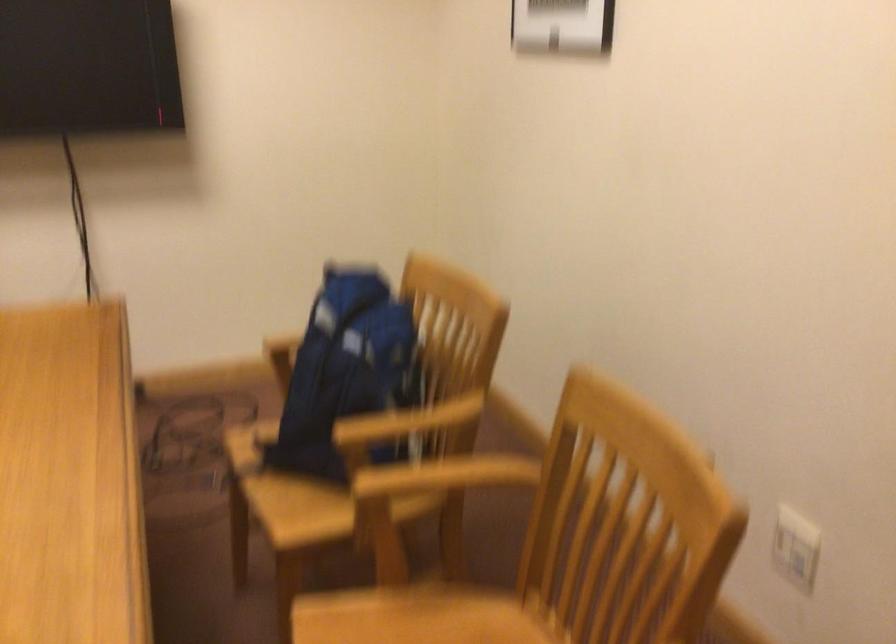
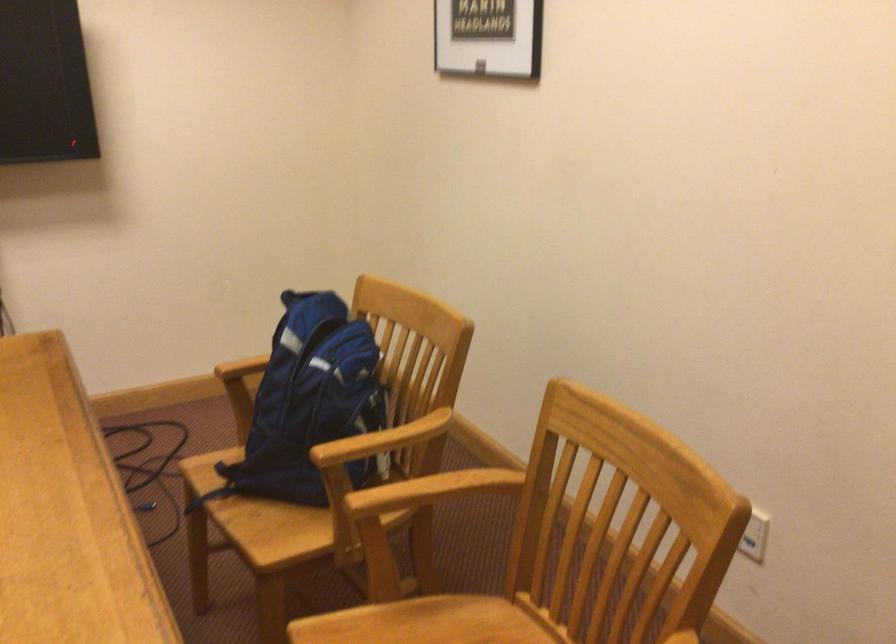
Locate, in the second image, the point that corresponds to point (341, 381) in the first image.

(309, 404)